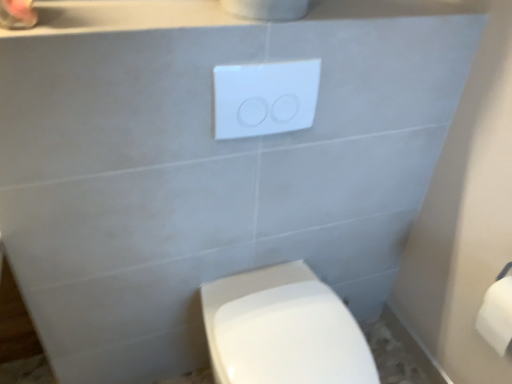
Question: Does white matte toilet paper at right have a lesser width compared to white plastic/light switch at upper center?

Choices:
 (A) yes
 (B) no

Answer: (B)

Question: Can you confirm if white matte toilet paper at right is wider than white plastic/light switch at upper center?

Choices:
 (A) yes
 (B) no

Answer: (A)

Question: From the image's perspective, is white matte toilet paper at right below white plastic/light switch at upper center?

Choices:
 (A) no
 (B) yes

Answer: (B)

Question: Is white matte toilet paper at right positioned far away from white plastic/light switch at upper center?

Choices:
 (A) yes
 (B) no

Answer: (B)

Question: Is white matte toilet paper at right turned away from white plastic/light switch at upper center?

Choices:
 (A) yes
 (B) no

Answer: (B)

Question: Choose the correct answer: Is white plastic/light switch at upper center inside white matte toilet paper at right or outside it?

Choices:
 (A) outside
 (B) inside

Answer: (A)

Question: Is white plastic/light switch at upper center wider or thinner than white matte toilet paper at right?

Choices:
 (A) thin
 (B) wide

Answer: (A)

Question: Considering the positions of white plastic/light switch at upper center and white matte toilet paper at right in the image, is white plastic/light switch at upper center taller or shorter than white matte toilet paper at right?

Choices:
 (A) tall
 (B) short

Answer: (B)

Question: Is white plastic/light switch at upper center bigger or smaller than white matte toilet paper at right?

Choices:
 (A) small
 (B) big

Answer: (A)

Question: Is white glossy toilet at lower center in front of or behind white plastic/light switch at upper center in the image?

Choices:
 (A) front
 (B) behind

Answer: (A)

Question: Considering the positions of point (321, 289) and point (298, 129), is point (321, 289) closer or farther from the camera than point (298, 129)?

Choices:
 (A) farther
 (B) closer

Answer: (A)

Question: From the image's perspective, is white glossy toilet at lower center positioned above or below white plastic/light switch at upper center?

Choices:
 (A) below
 (B) above

Answer: (A)

Question: Is white glossy toilet at lower center wider or thinner than white plastic/light switch at upper center?

Choices:
 (A) thin
 (B) wide

Answer: (B)

Question: From a real-world perspective, relative to white glossy toilet at lower center, is white plastic/light switch at upper center vertically above or below?

Choices:
 (A) above
 (B) below

Answer: (A)

Question: Is white plastic/light switch at upper center taller or shorter than white glossy toilet at lower center?

Choices:
 (A) tall
 (B) short

Answer: (B)